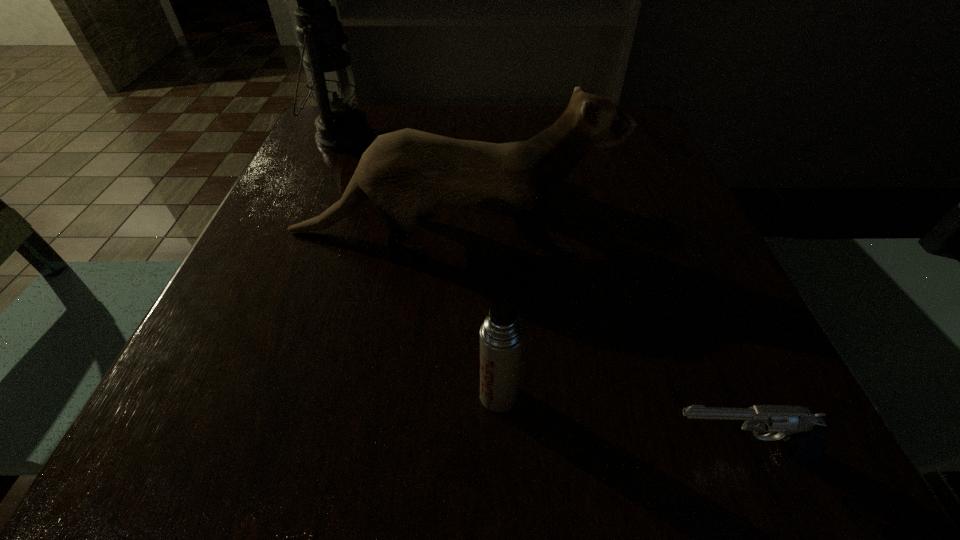
What are the coordinates of `the farthest object` in the screenshot? It's located at pos(340,127).

Find the location of a particular element. oil lamp is located at coordinates (340, 127).

At what (x,y) coordinates should I click in order to perform the action: click on ferret. Please return your answer as a coordinate pair (x, y). Looking at the image, I should click on (406, 173).

You are a GUI agent. You are given a task and a screenshot of the screen. Output one action in this format:
    pyautogui.click(x=<x>, y=<y>)
    Task: Click on the second farthest object
    The height and width of the screenshot is (540, 960).
    Given the screenshot: What is the action you would take?
    pyautogui.click(x=406, y=173)

Locate an element on the screen. Image resolution: width=960 pixels, height=540 pixels. the third tallest object is located at coordinates (501, 335).

Where is `the third farthest object`? the third farthest object is located at coordinates (501, 335).

Find the location of a particular element. This screenshot has height=540, width=960. gun is located at coordinates (803, 432).

Locate an element on the screen. Image resolution: width=960 pixels, height=540 pixels. the shortest object is located at coordinates (803, 432).

Where is `vacant space located 0.130m on the front of the oil lamp`? vacant space located 0.130m on the front of the oil lamp is located at coordinates (316, 196).

I want to click on vacant space situated on the face of the second farthest object, so click(x=688, y=232).